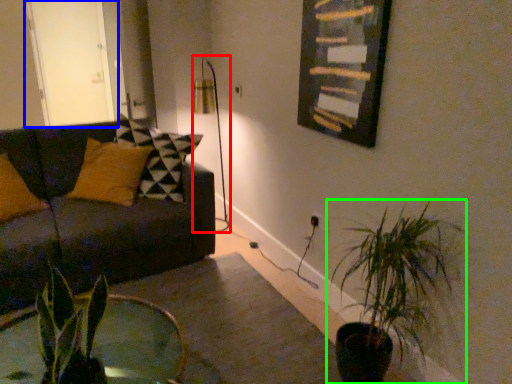
Question: Which object is positioned closest to table lamp (highlighted by a red box)? Select from glass door (highlighted by a blue box) and houseplant (highlighted by a green box).

Choices:
 (A) glass door
 (B) houseplant

Answer: (A)